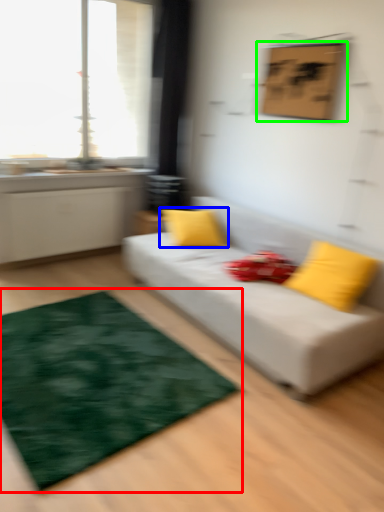
Question: Considering the real-world distances, which object is farthest from mat (highlighted by a red box)? pillow (highlighted by a blue box) or picture frame (highlighted by a green box)?

Choices:
 (A) pillow
 (B) picture frame

Answer: (B)